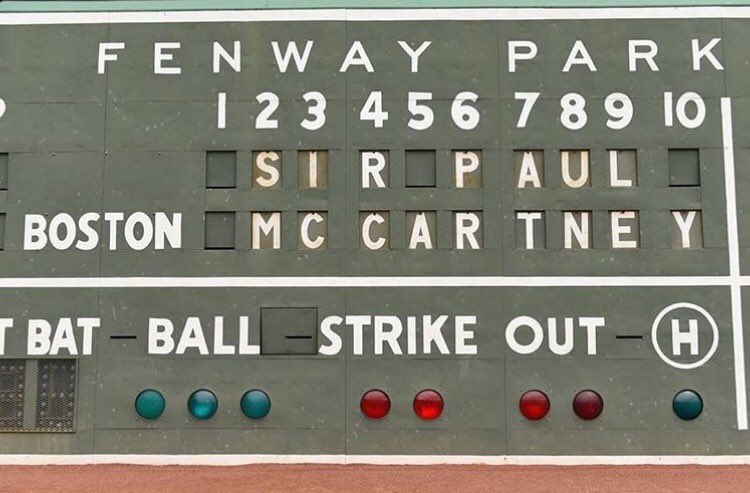
Identify the location of light. The height and width of the screenshot is (493, 750). (676, 401), (588, 399), (530, 399), (438, 396), (366, 399), (255, 397), (202, 406), (153, 402).